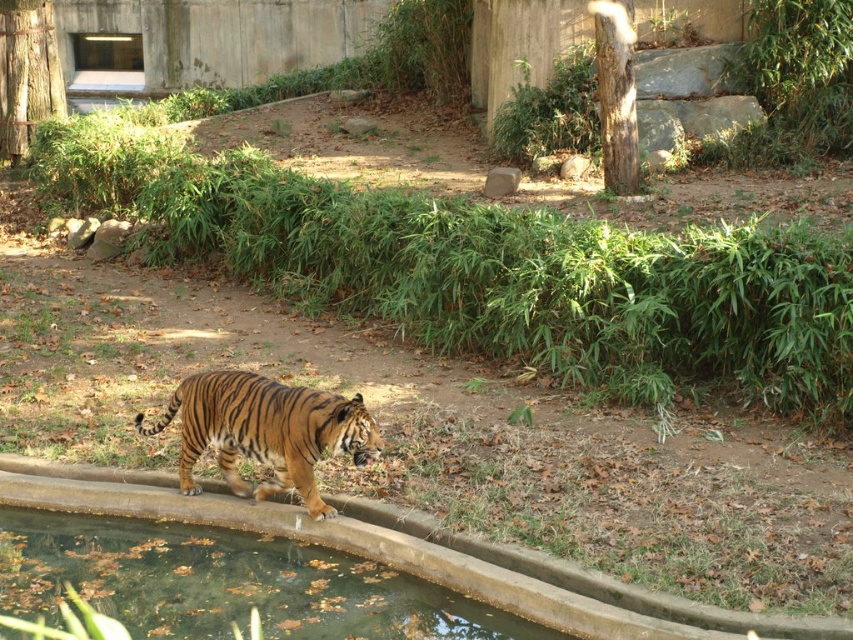
Does point (405, 593) lie in front of point (265, 444)?

Yes.

Between clear glass puddle at lower left and orange-brown striped tiger at center, which one is positioned higher?

orange-brown striped tiger at center is higher up.

The height and width of the screenshot is (640, 853). Identify the location of clear glass puddle at lower left. (227, 582).